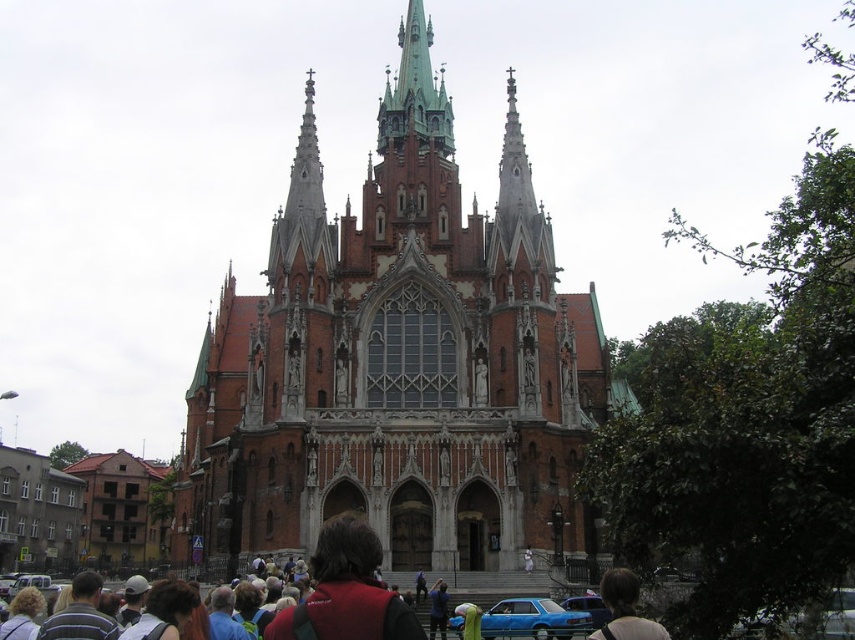
Which is more to the right, dark brown leather backpack at center or blue matte car at lower center?

blue matte car at lower center

Is point (292, 620) farther from viewer compared to point (550, 616)?

No, it is not.

The height and width of the screenshot is (640, 855). I want to click on dark brown leather backpack at center, so click(346, 592).

Which is more to the left, red brick church at center or blue metallic car at center?

From the viewer's perspective, red brick church at center appears more on the left side.

Which of these two, red brick church at center or blue metallic car at center, stands taller?

Standing taller between the two is red brick church at center.

The image size is (855, 640). Describe the element at coordinates (399, 364) in the screenshot. I see `red brick church at center` at that location.

Find the location of a particular element. Image resolution: width=855 pixels, height=640 pixels. red brick church at center is located at coordinates (399, 364).

Can you confirm if red brick church at center is positioned below dark brown hair at center?

Actually, red brick church at center is above dark brown hair at center.

Where is `red brick church at center`? The image size is (855, 640). red brick church at center is located at coordinates (399, 364).

Where is `red brick church at center`? red brick church at center is located at coordinates (399, 364).